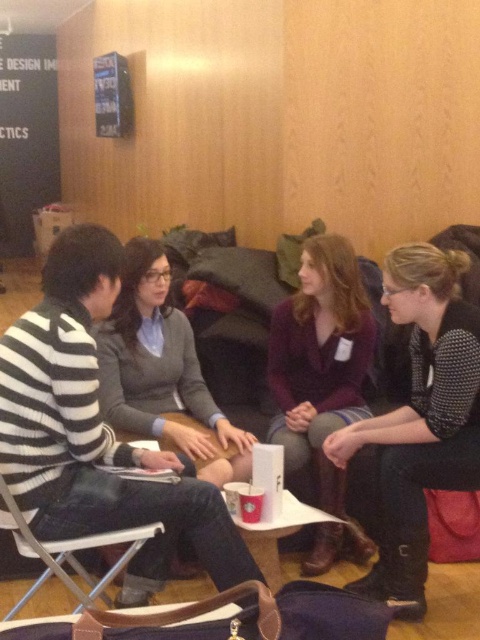
Is matte gray sweater at center to the left of metallic silver folding chair at lower left from the viewer's perspective?

No, matte gray sweater at center is not to the left of metallic silver folding chair at lower left.

Consider the image. Does matte gray sweater at center come behind metallic silver folding chair at lower left?

That is True.

Who is more forward, (129, 388) or (88, 579)?

Positioned in front is point (88, 579).

Locate an element on the screen. The height and width of the screenshot is (640, 480). matte gray sweater at center is located at coordinates (160, 369).

Does purple velvet blazer at center appear under metallic silver folding chair at lower left?

No, purple velvet blazer at center is not below metallic silver folding chair at lower left.

Who is more forward, [325,369] or [60,563]?

Point [60,563] is in front.

Identify the location of purple velvet blazer at center. The image size is (480, 640). [x=322, y=380].

Can you confirm if black dotted shirt at right is taller than metallic silver folding chair at lower left?

Correct, black dotted shirt at right is much taller as metallic silver folding chair at lower left.

Is black dotted shirt at right below metallic silver folding chair at lower left?

Actually, black dotted shirt at right is above metallic silver folding chair at lower left.

Does point (457, 259) come in front of point (48, 541)?

No, (457, 259) is further to viewer.

The height and width of the screenshot is (640, 480). I want to click on black dotted shirt at right, so click(420, 419).